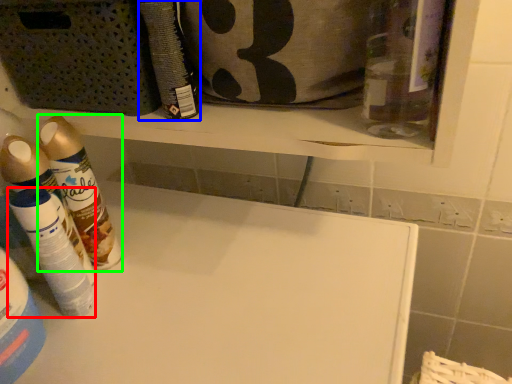
Question: Considering the real-world distances, which object is closest to cleaning product (highlighted by a red box)? cleaning product (highlighted by a blue box) or cleaning product (highlighted by a green box).

Choices:
 (A) cleaning product
 (B) cleaning product

Answer: (B)